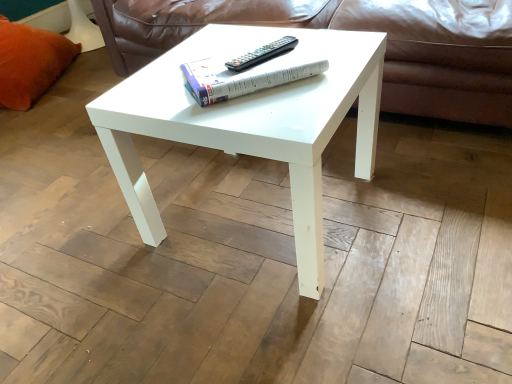
Question: From a real-world perspective, is orange plush pillow at left under white glossy coffee table at center?

Choices:
 (A) no
 (B) yes

Answer: (A)

Question: Is orange plush pillow at left not inside white glossy coffee table at center?

Choices:
 (A) no
 (B) yes

Answer: (B)

Question: Is white glossy coffee table at center inside orange plush pillow at left?

Choices:
 (A) no
 (B) yes

Answer: (A)

Question: Considering the relative sizes of orange plush pillow at left and white glossy coffee table at center in the image provided, is orange plush pillow at left smaller than white glossy coffee table at center?

Choices:
 (A) yes
 (B) no

Answer: (B)

Question: Can you confirm if orange plush pillow at left is shorter than white glossy coffee table at center?

Choices:
 (A) no
 (B) yes

Answer: (A)

Question: In the image, is white paper at center on the left side or the right side of leather at center?

Choices:
 (A) right
 (B) left

Answer: (B)

Question: Considering the positions of point (228, 74) and point (401, 89), is point (228, 74) closer or farther from the camera than point (401, 89)?

Choices:
 (A) closer
 (B) farther

Answer: (A)

Question: From a real-world perspective, is white paper at center above or below leather at center?

Choices:
 (A) below
 (B) above

Answer: (B)

Question: In terms of width, does white paper at center look wider or thinner when compared to leather at center?

Choices:
 (A) wide
 (B) thin

Answer: (B)

Question: In terms of height, does white glossy coffee table at center look taller or shorter compared to white paper at center?

Choices:
 (A) tall
 (B) short

Answer: (A)

Question: Does point 185,51 appear closer or farther from the camera than point 219,56?

Choices:
 (A) closer
 (B) farther

Answer: (B)

Question: Is white glossy coffee table at center in front of or behind white paper at center in the image?

Choices:
 (A) front
 (B) behind

Answer: (A)

Question: Would you say white glossy coffee table at center is inside or outside white paper at center?

Choices:
 (A) inside
 (B) outside

Answer: (B)

Question: Considering the positions of point (x=266, y=44) and point (x=194, y=67), is point (x=266, y=44) closer or farther from the camera than point (x=194, y=67)?

Choices:
 (A) farther
 (B) closer

Answer: (A)

Question: Considering their positions, is black plastic remote at center located in front of or behind white paper at center?

Choices:
 (A) behind
 (B) front

Answer: (A)